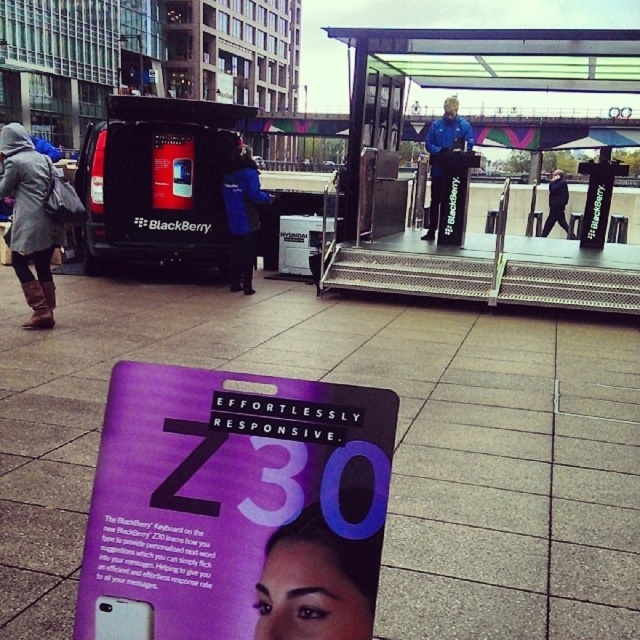
Question: Is purple glossy magazine at lower center positioned in front of metallic silver bus stop at center?

Choices:
 (A) no
 (B) yes

Answer: (B)

Question: Which of these objects is positioned closest to the purple glossy magazine at lower center?

Choices:
 (A) leather boots at lower left
 (B) black leather jacket at center

Answer: (A)

Question: Among these objects, which one is nearest to the camera?

Choices:
 (A) blue fabric jacket at center
 (B) metallic silver bus stop at center
 (C) purple glossy magazine at lower center

Answer: (C)

Question: Does purple glossy magazine at lower center have a smaller size compared to blue fabric jacket at center?

Choices:
 (A) no
 (B) yes

Answer: (B)

Question: Does purple glossy magazine at lower center appear over smooth purple poster at center?

Choices:
 (A) no
 (B) yes

Answer: (B)

Question: Among these objects, which one is farthest from the camera?

Choices:
 (A) blue fabric jacket at center
 (B) black leather jacket at center
 (C) smooth purple poster at center

Answer: (B)